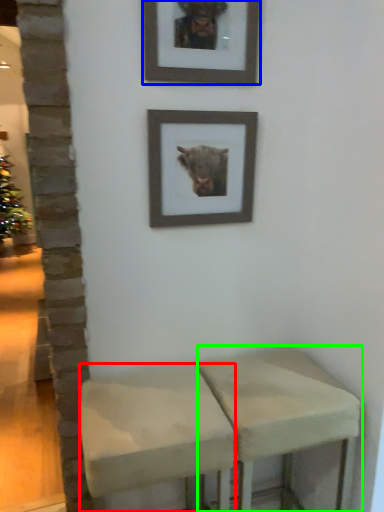
Question: Which object is positioned closest to stool (highlighted by a red box)? Select from picture frame (highlighted by a blue box) and stool (highlighted by a green box).

Choices:
 (A) picture frame
 (B) stool

Answer: (B)